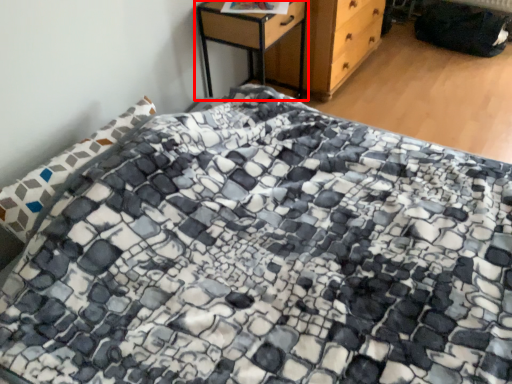
Question: From the image, what is the correct spatial relationship of nightstand (annotated by the red box) in relation to chest of drawers?

Choices:
 (A) right
 (B) left

Answer: (B)